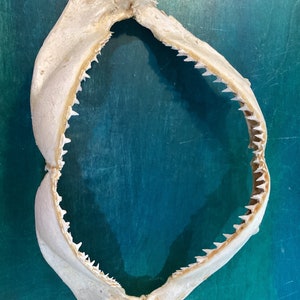
This screenshot has width=300, height=300. Identify the location of scratch on wall. (291, 136).